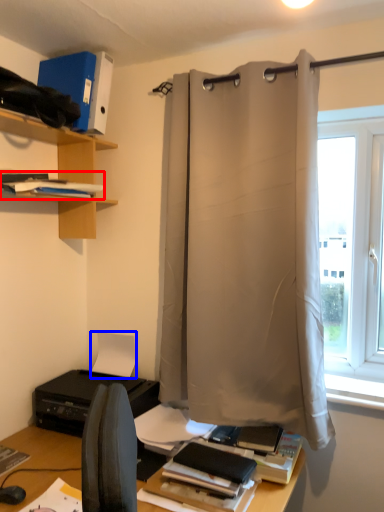
Question: Which point is further to the camera, book (highlighted by a red box) or paper (highlighted by a blue box)?

Choices:
 (A) book
 (B) paper

Answer: (B)